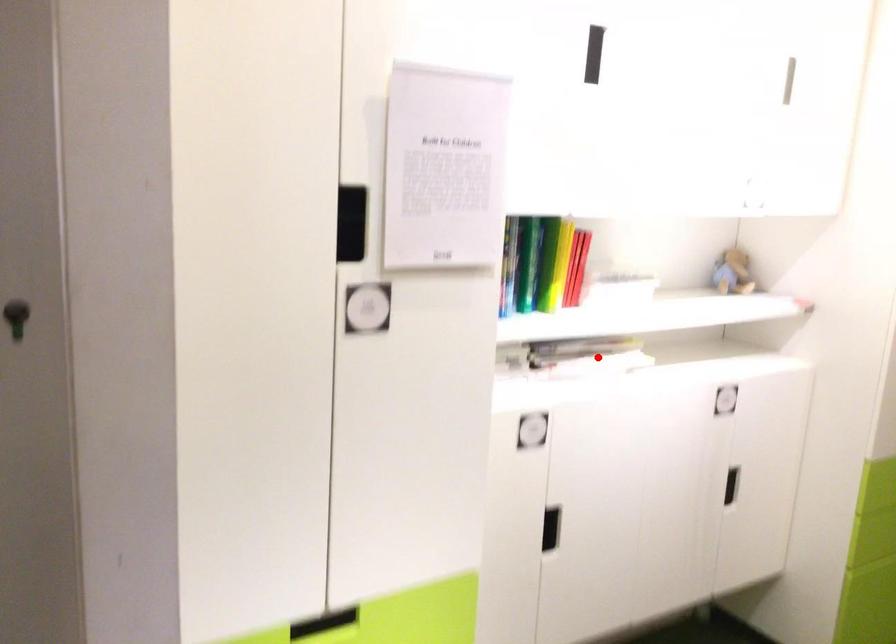
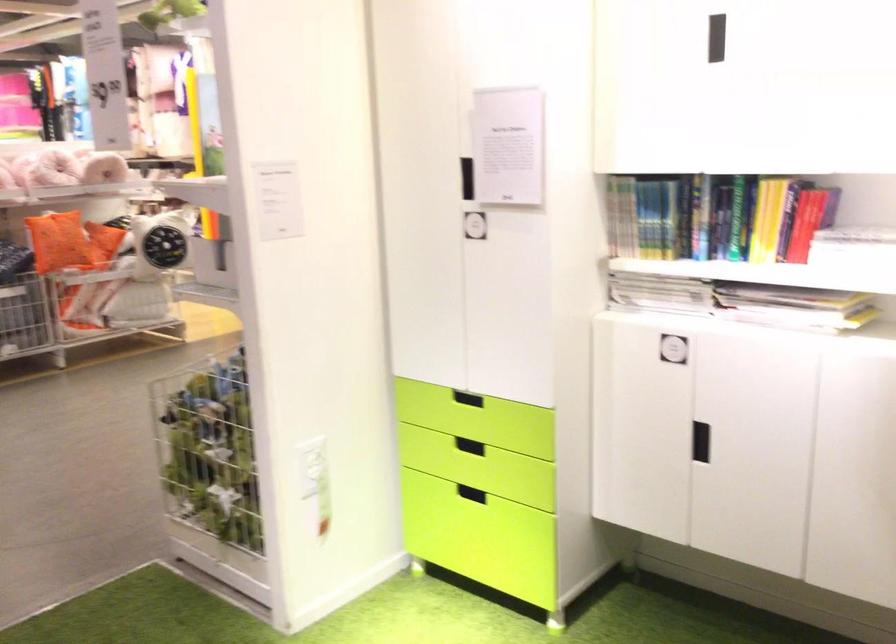
Where in the second image is the point corresponding to the highlighted location from the first image?

(794, 307)